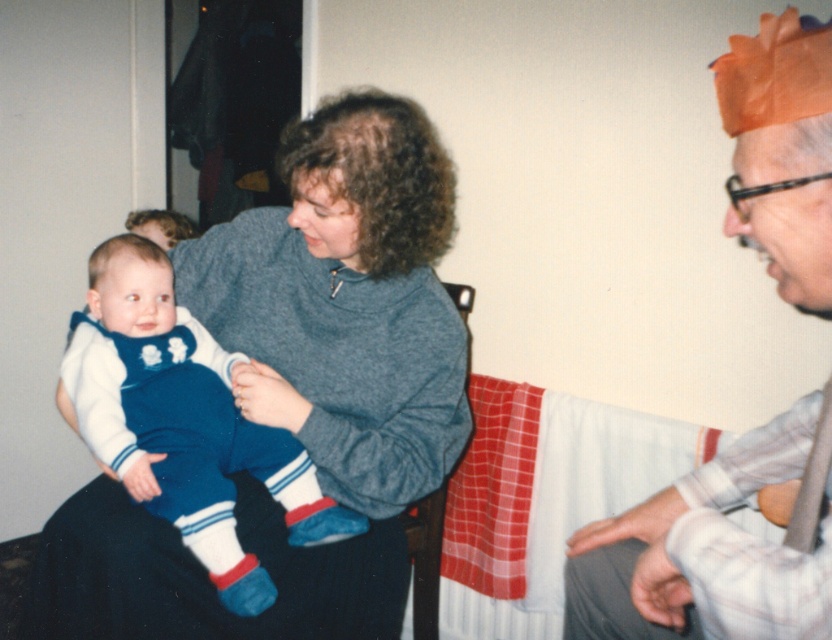
You are a fashion designer observing the matte gray shirt at right and the velvet blue jumpsuit at center in the image. Which clothing item is narrower?

The matte gray shirt at right is narrower than the velvet blue jumpsuit at center.